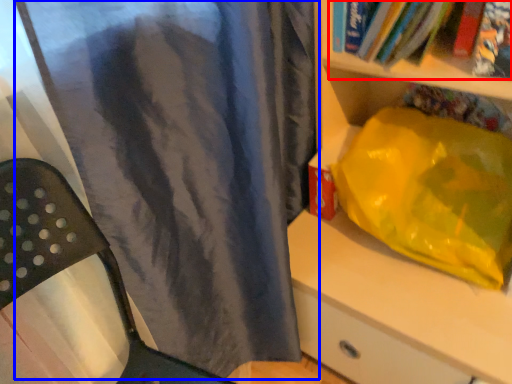
Question: Which object appears closest to the camera in this image, book (highlighted by a red box) or curtain (highlighted by a blue box)?

Choices:
 (A) book
 (B) curtain

Answer: (B)